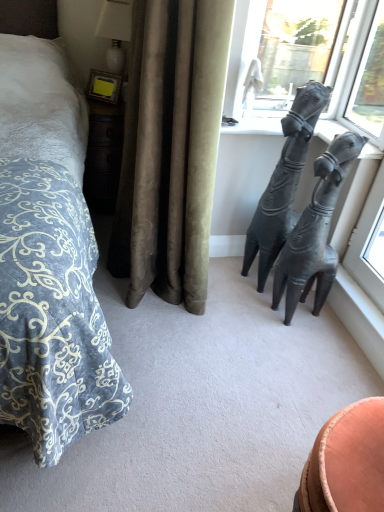
Question: From the image's perspective, is black matte hand sculpture at upper right, which is the 1th statue (sculpture) from right to left, located above or below black matte sculpture at right, which is the 2th statue (sculpture) from right to left?

Choices:
 (A) below
 (B) above

Answer: (A)

Question: Based on their sizes in the image, would you say black matte hand sculpture at upper right, which is the 1th statue (sculpture) from right to left, is bigger or smaller than black matte sculpture at right, which is the 2th statue (sculpture) from right to left?

Choices:
 (A) small
 (B) big

Answer: (A)

Question: Which object is positioned farthest from the satin beige curtain at center?

Choices:
 (A) black matte hand sculpture at upper right, which is the 1th statue (sculpture) from right to left
 (B) transparent glass window at upper right, the 1th window from the right
 (C) transparent glass window at upper right, the second window from the right
 (D) black matte sculpture at right, which is counted as the first statue (sculpture), starting from the left
 (E) white glossy lamp at upper left

Answer: (B)

Question: Estimate the real-world distances between objects in this image. Which object is closer to the transparent glass window at upper right, the second window from the right?

Choices:
 (A) white glossy lamp at upper left
 (B) black matte sculpture at right, which is counted as the first statue (sculpture), starting from the left
 (C) transparent glass window at upper right, the 1th window from the right
 (D) black matte hand sculpture at upper right, which is the 1th statue (sculpture) from right to left
 (E) satin beige curtain at center

Answer: (C)